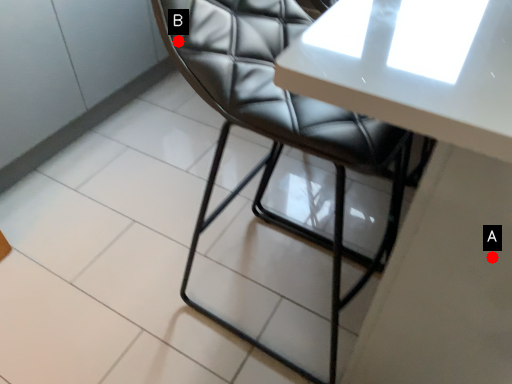
Question: Two points are circled on the image, labeled by A and B beside each circle. Which point is further to the camera?

Choices:
 (A) A is further
 (B) B is further

Answer: (B)